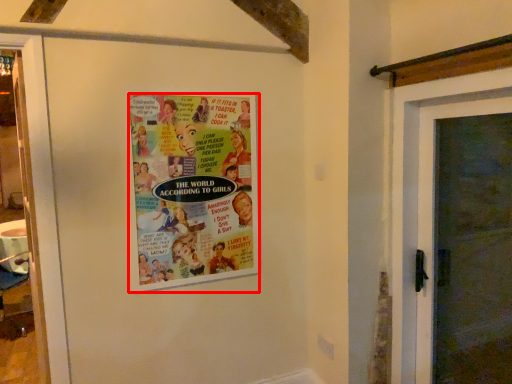
Question: From the image's perspective, where is poster (annotated by the red box) located in relation to door in the image?

Choices:
 (A) above
 (B) below

Answer: (A)